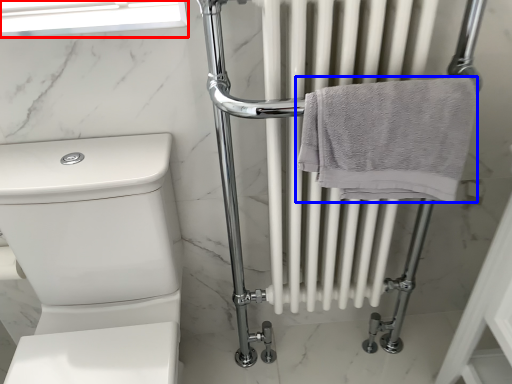
Question: Which of the following is the closest to the observer, window screen (highlighted by a red box) or towel (highlighted by a blue box)?

Choices:
 (A) window screen
 (B) towel

Answer: (B)